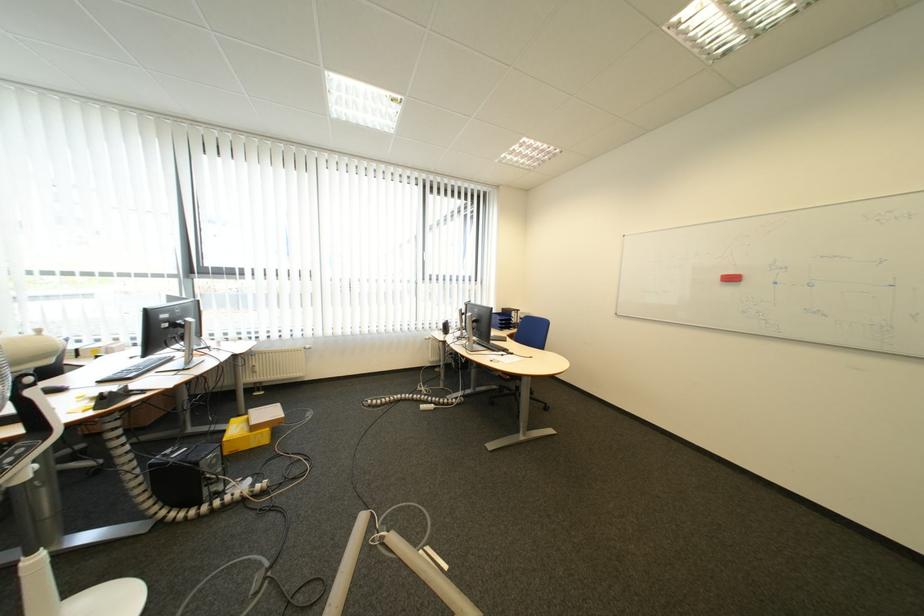
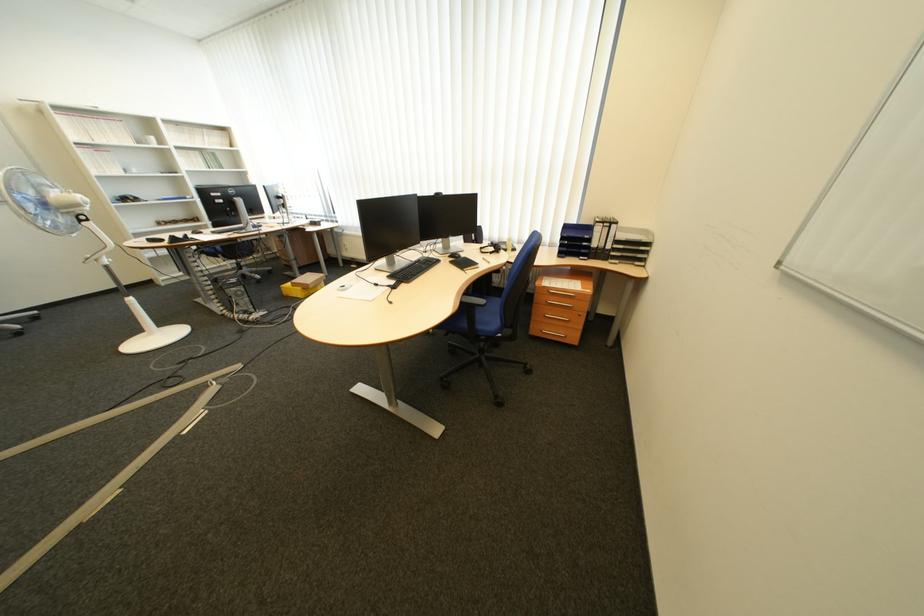
The point at [514,313] is marked in the first image. Where is the corresponding point in the second image?

(604, 225)